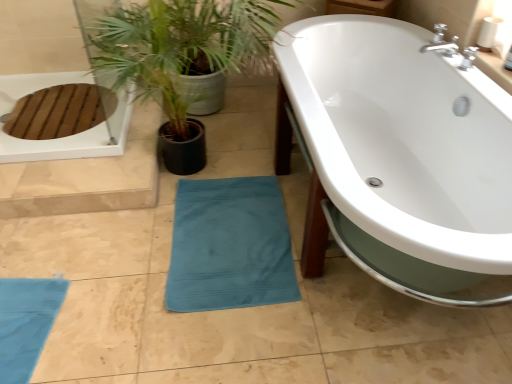
Question: Should I look upward or downward to see teal fabric plant at lower center?

Choices:
 (A) up
 (B) down

Answer: (A)

Question: Is teal fabric plant at lower center outside of teal cotton beach towel at lower center?

Choices:
 (A) yes
 (B) no

Answer: (A)

Question: Considering the relative positions of teal fabric plant at lower center and teal cotton beach towel at lower center in the image provided, is teal fabric plant at lower center to the left of teal cotton beach towel at lower center from the viewer's perspective?

Choices:
 (A) no
 (B) yes

Answer: (B)

Question: Can you confirm if teal fabric plant at lower center is wider than teal cotton beach towel at lower center?

Choices:
 (A) no
 (B) yes

Answer: (B)

Question: Can you confirm if teal fabric plant at lower center is smaller than teal cotton beach towel at lower center?

Choices:
 (A) yes
 (B) no

Answer: (B)

Question: Can you confirm if teal fabric plant at lower center is shorter than teal cotton beach towel at lower center?

Choices:
 (A) no
 (B) yes

Answer: (A)

Question: From a real-world perspective, is teal fabric plant at lower center over teal cotton beach towel at lower center?

Choices:
 (A) yes
 (B) no

Answer: (A)

Question: From the image's perspective, does teal cotton beach towel at lower center appear lower than white glossy bathtub at center?

Choices:
 (A) no
 (B) yes

Answer: (B)

Question: Can you confirm if teal cotton beach towel at lower center is bigger than white glossy bathtub at center?

Choices:
 (A) no
 (B) yes

Answer: (A)

Question: Can you confirm if teal cotton beach towel at lower center is thinner than white glossy bathtub at center?

Choices:
 (A) yes
 (B) no

Answer: (A)

Question: Does teal cotton beach towel at lower center have a greater height compared to white glossy bathtub at center?

Choices:
 (A) no
 (B) yes

Answer: (A)

Question: Does teal cotton beach towel at lower center have a greater width compared to white glossy bathtub at center?

Choices:
 (A) no
 (B) yes

Answer: (A)

Question: Would you consider teal cotton beach towel at lower center to be distant from white glossy bathtub at center?

Choices:
 (A) no
 (B) yes

Answer: (A)

Question: Are teal cotton beach towel at lower center and teal fabric plant at lower center beside each other?

Choices:
 (A) yes
 (B) no

Answer: (B)